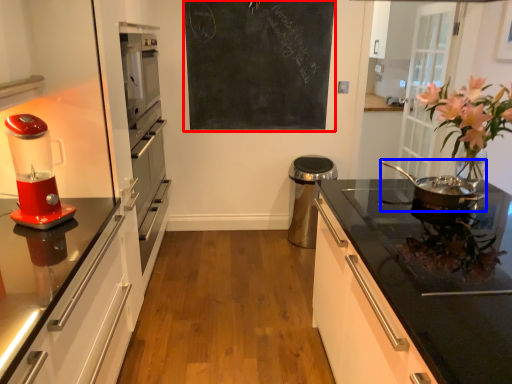
Question: Which object is closer to the camera taking this photo, bulletin board (highlighted by a red box) or kitchen appliance (highlighted by a blue box)?

Choices:
 (A) bulletin board
 (B) kitchen appliance

Answer: (B)